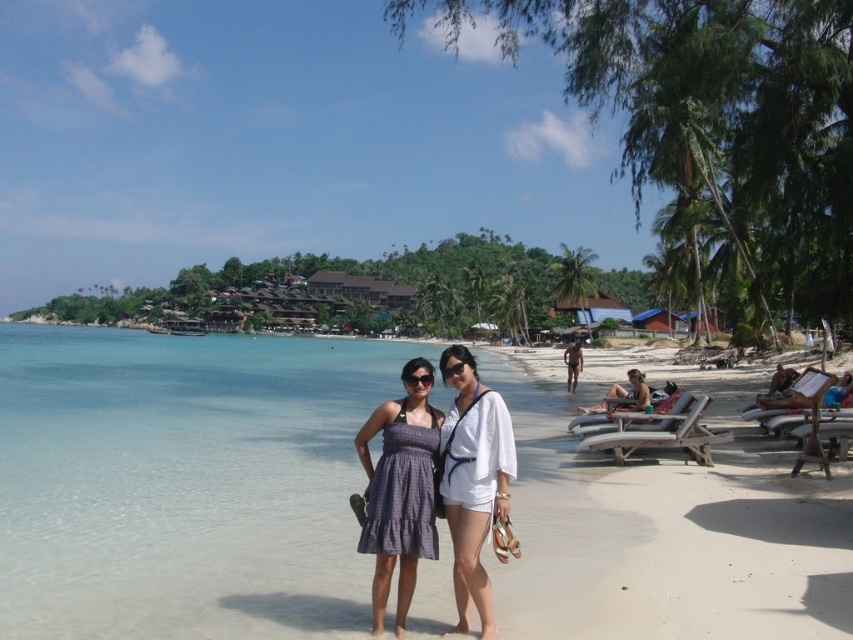
You are a photographer planning to take a portrait of the two people wearing the matte purple dress at center and the white cotton shorts at center. Since you want to ensure the subjects are balanced in the frame, which clothing item should you position closer to the camera to compensate for their height difference?

The matte purple dress at center has a lesser height compared to the white cotton shorts at center. To balance the subjects in the frame, position the person in the matte purple dress at center closer to the camera so that their apparent height in the photo matches the taller white cotton shorts at center.

You are standing on the white sand beach at center and want to see the tan skin man at center. Which object is higher in the image?

The white sand beach at center is much taller than the tan skin man at center, so the white sand beach at center is higher in the image.